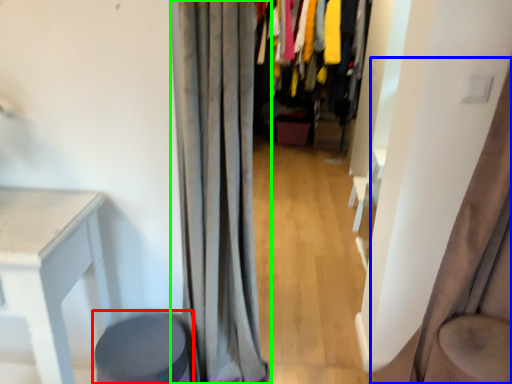
Question: Considering the real-world distances, which object is farthest from music stool (highlighted by a red box)? curtain (highlighted by a blue box) or curtain (highlighted by a green box)?

Choices:
 (A) curtain
 (B) curtain

Answer: (A)